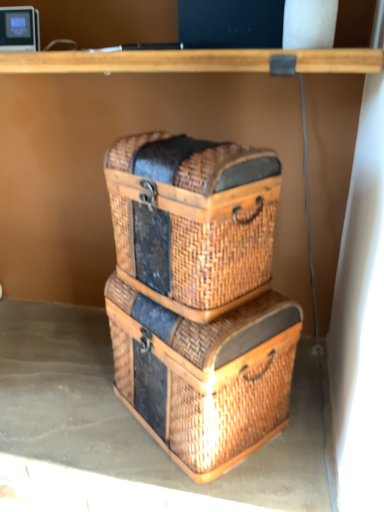
Question: Is woven brown crate at center wider or thinner than woven brown basket at center?

Choices:
 (A) thin
 (B) wide

Answer: (A)

Question: Which is correct: woven brown crate at center is inside woven brown basket at center, or outside of it?

Choices:
 (A) outside
 (B) inside

Answer: (A)

Question: Estimate the real-world distances between objects in this image. Which object is farther from the woven brown basket at center?

Choices:
 (A) woven brown basket at center
 (B) woven brown crate at center

Answer: (A)

Question: Based on their relative distances, which object is nearer to the woven brown crate at center?

Choices:
 (A) woven brown basket at center
 (B) woven brown basket at center

Answer: (A)